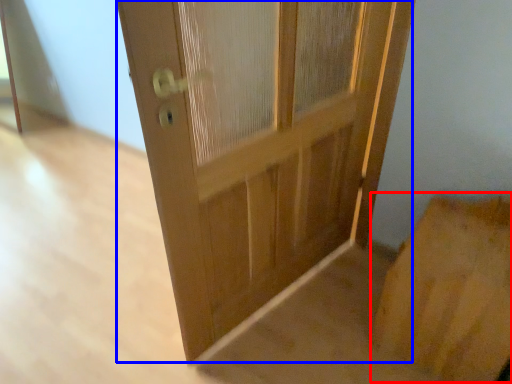
Question: Which of the following is the farthest to the observer, cardboard box (highlighted by a red box) or door (highlighted by a blue box)?

Choices:
 (A) cardboard box
 (B) door

Answer: (A)